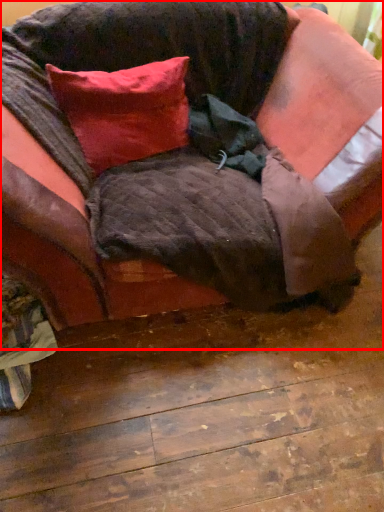
Question: From the image's perspective, where is studio couch (annotated by the red box) located relative to pillow?

Choices:
 (A) below
 (B) above

Answer: (A)